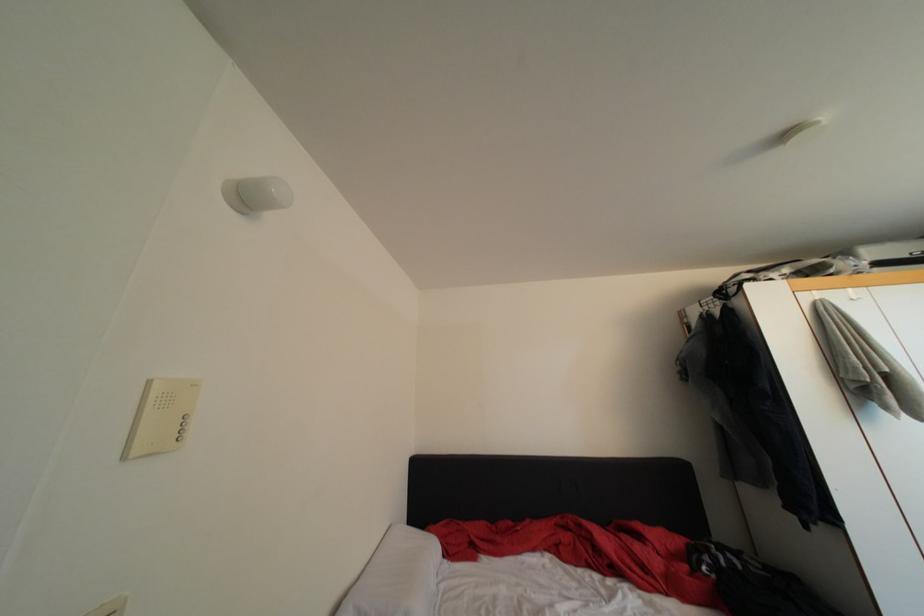
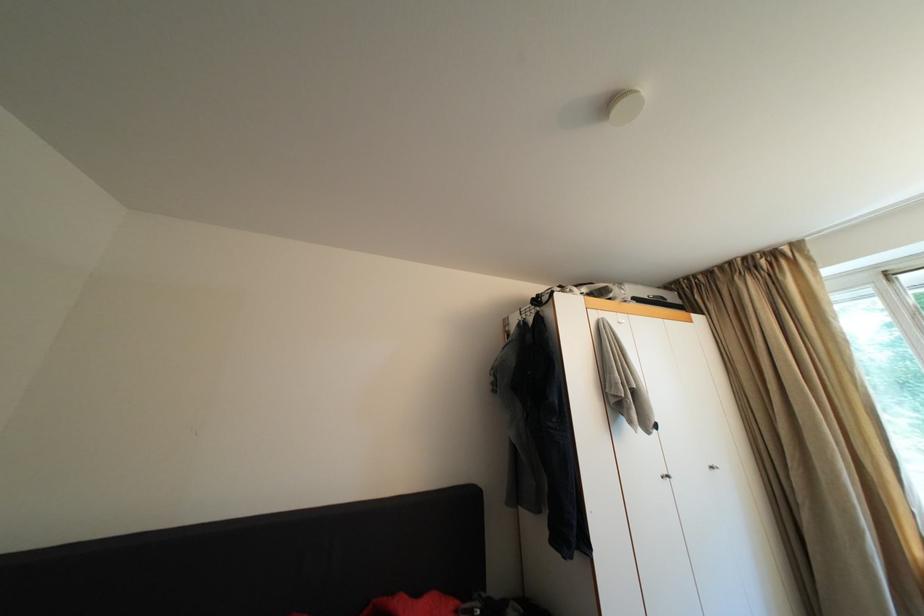
Question: How did the camera likely rotate?

Choices:
 (A) Left
 (B) Right
 (C) Up
 (D) Down

Answer: (B)